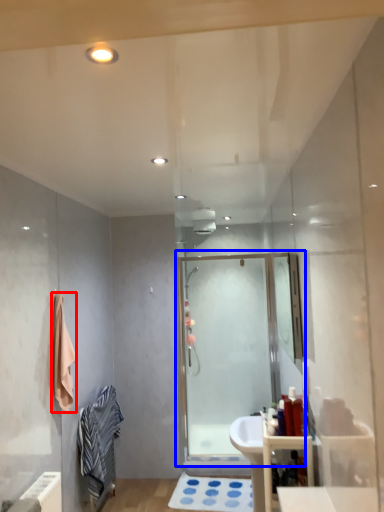
Question: Which of the following is the farthest to the observer, bath towel (highlighted by a red box) or screen door (highlighted by a blue box)?

Choices:
 (A) bath towel
 (B) screen door

Answer: (B)